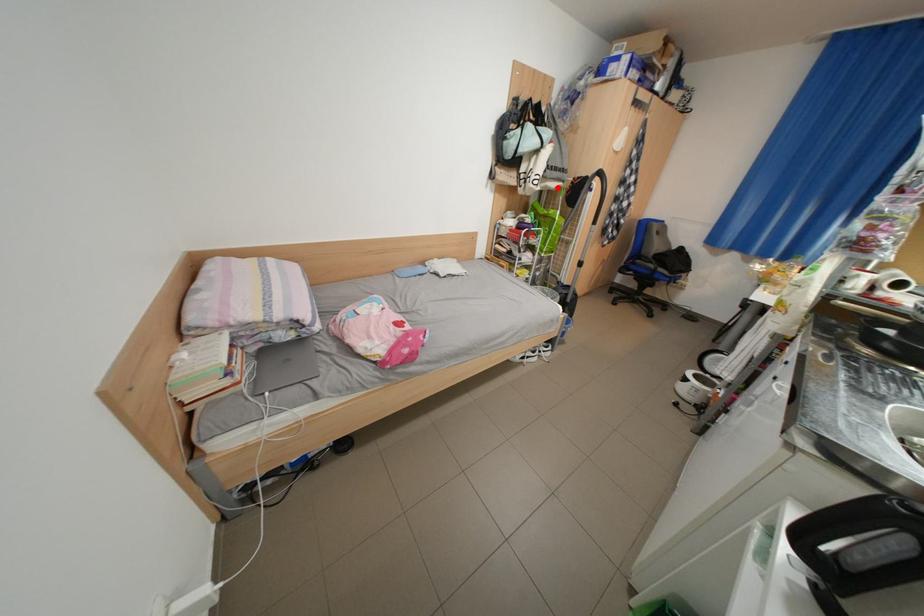
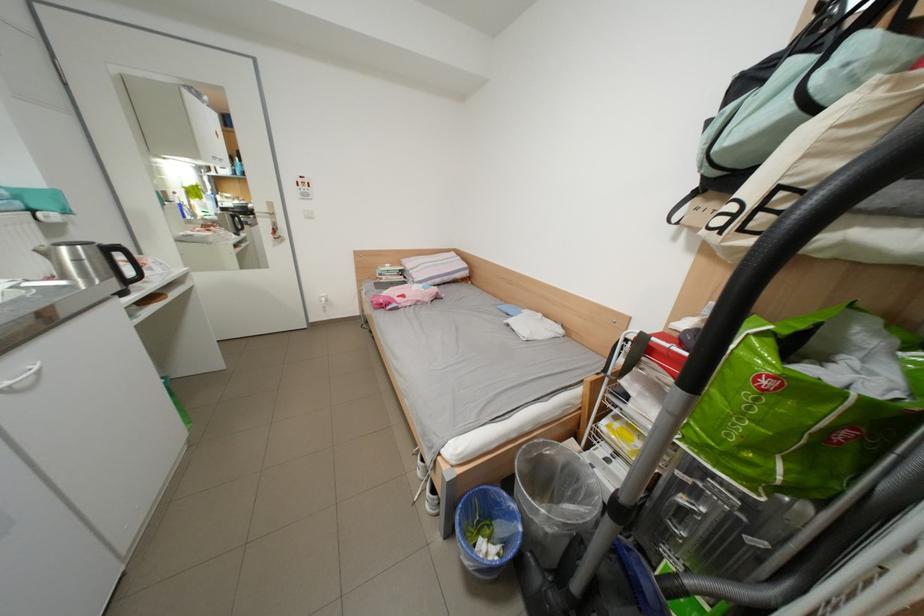
In the second image, find the point that corresponds to the highlighted location in the first image.

(856, 245)